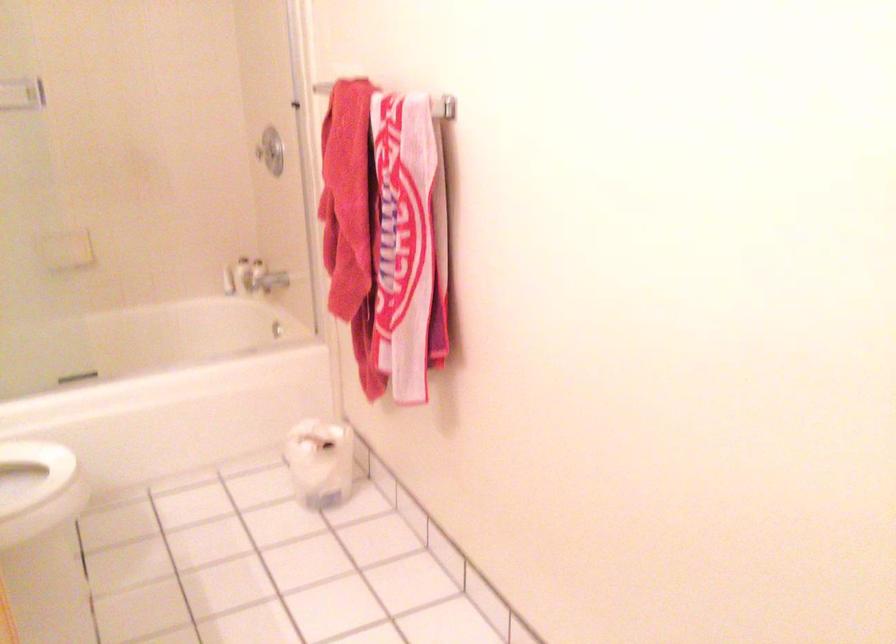
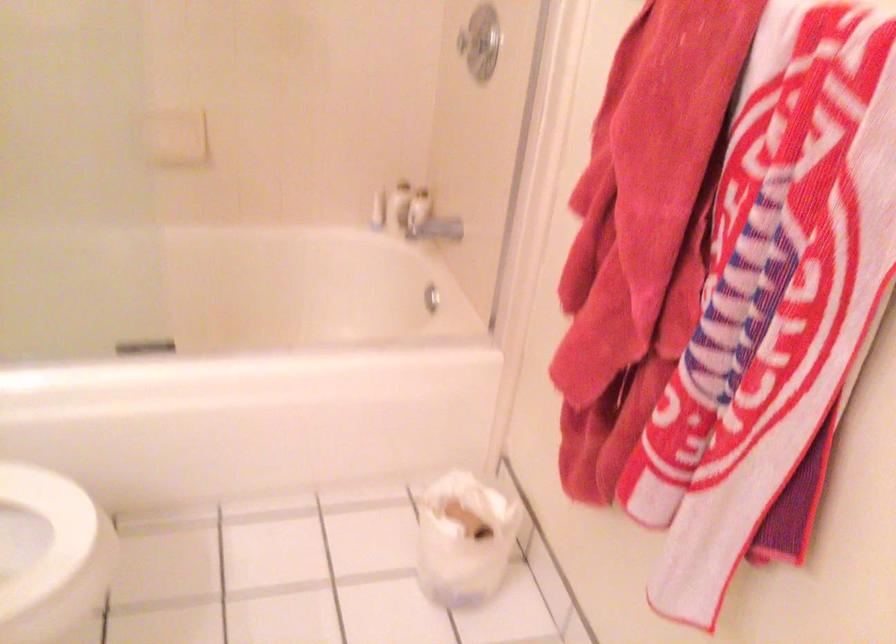
Locate, in the second image, the point that corresponds to (x=277, y=330) in the first image.

(431, 298)